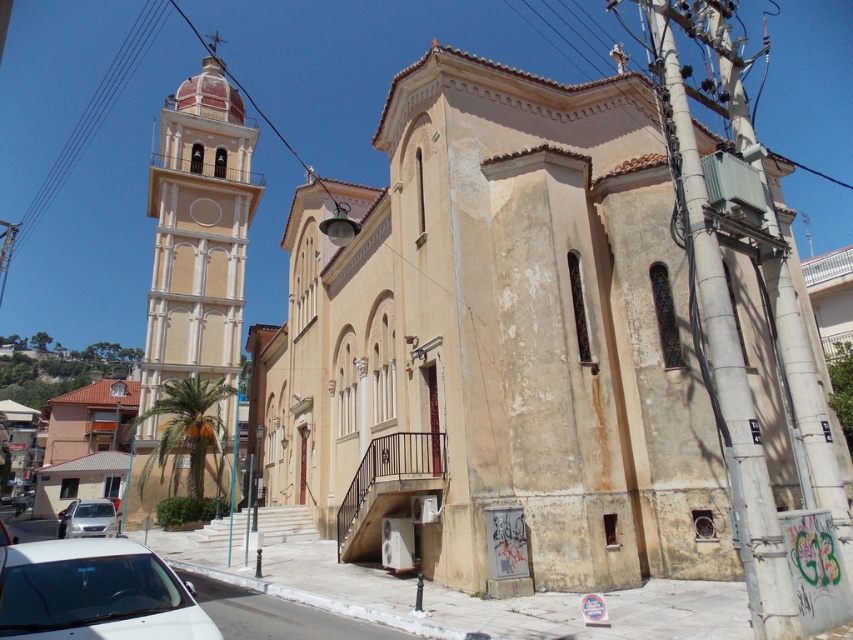
Consider the image. You are standing on the street in front of the church. You want to take a photo of the beige stucco bell tower at left. Where should you position yourself to ensure the bell tower is centered in your camera frame?

To center the beige stucco bell tower at left in your camera frame, position yourself directly in front of the bell tower at its coordinates point (x=196, y=237).

You are standing at the center of the street and want to take a photo of the beige stucco church at center. If the camera is set to focus at coordinates 0.5, 0.6, will the church be in focus?

The beige stucco church at center is positioned at point [498,340], which is close to the camera focus coordinates of [511,320]. Therefore, the church will likely be in focus.

You are standing on the sidewalk in front of the church and want to take a photo of the beige stucco bell tower at left without including the white matte car at lower left in the frame. Based on their positions, is this possible?

The beige stucco bell tower at left is to the left of the white matte car at lower left, so if you position yourself to the left of the car, you can capture the bell tower without the car in the frame.